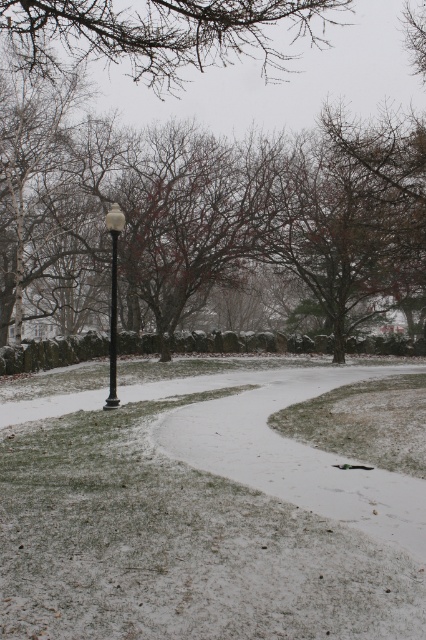
Question: Observing the image, what is the correct spatial positioning of snowy grass at lower center in reference to white glossy lamp post at center?

Choices:
 (A) above
 (B) below

Answer: (B)

Question: Is snowy grass at lower center bigger than white glossy lamp post at center?

Choices:
 (A) yes
 (B) no

Answer: (B)

Question: Estimate the real-world distances between objects in this image. Which object is closer to the white glossy lamp post at center?

Choices:
 (A) snowy grass at lower center
 (B) brown textured branches at upper center

Answer: (A)

Question: Which object is the farthest from the white glossy lamp post at center?

Choices:
 (A) brown textured branches at upper center
 (B) snowy grass at lower center

Answer: (A)

Question: Which is nearer to the white glossy lamp post at center?

Choices:
 (A) snowy grass at lower center
 (B) brown textured branches at upper center

Answer: (A)

Question: Can you confirm if brown textured branches at upper center is wider than white glossy lamp post at center?

Choices:
 (A) yes
 (B) no

Answer: (A)